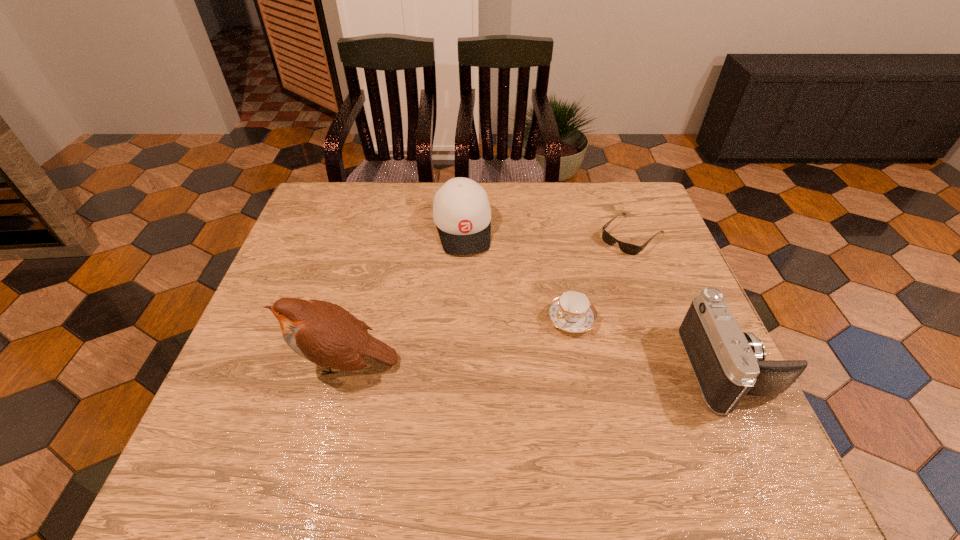
Locate an element on the screen. free location located on the front-facing side of the sunglasses is located at coordinates (523, 333).

The image size is (960, 540). Identify the location of free spot located on the front-facing side of the sunglasses. (568, 292).

The width and height of the screenshot is (960, 540). Identify the location of free location located 0.310m on the front-facing side of the sunglasses. (546, 312).

Identify the location of vacant region located 0.400m on the front-facing side of the third tallest object. (487, 384).

Find the location of a particular element. Image resolution: width=960 pixels, height=540 pixels. free space located 0.210m on the front-facing side of the third tallest object is located at coordinates (475, 315).

Find the location of a particular element. Image resolution: width=960 pixels, height=540 pixels. free location located on the front-facing side of the third tallest object is located at coordinates (485, 372).

You are a GUI agent. You are given a task and a screenshot of the screen. Output one action in this format:
    pyautogui.click(x=<x>, y=<y>)
    Task: Click on the vacant region located on the side with the handle of the second shortest object
    The width and height of the screenshot is (960, 540).
    Given the screenshot: What is the action you would take?
    pyautogui.click(x=453, y=401)

Locate an element on the screen. vacant area situated 0.120m on the side with the handle of the second shortest object is located at coordinates (516, 358).

Image resolution: width=960 pixels, height=540 pixels. In order to click on free spot located on the side with the handle of the second shortest object in this screenshot , I will do `click(476, 385)`.

I want to click on sunglasses that is at the far edge, so click(627, 248).